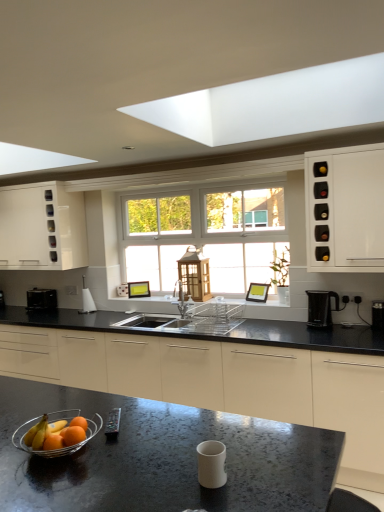
Question: Can you confirm if black plastic coffee machine at right is positioned to the right of clear glass bowl at lower left?

Choices:
 (A) yes
 (B) no

Answer: (A)

Question: Can you confirm if black plastic coffee machine at right is thinner than clear glass bowl at lower left?

Choices:
 (A) no
 (B) yes

Answer: (B)

Question: Is black plastic coffee machine at right oriented away from clear glass bowl at lower left?

Choices:
 (A) no
 (B) yes

Answer: (A)

Question: Is black plastic coffee machine at right to the left of clear glass bowl at lower left from the viewer's perspective?

Choices:
 (A) no
 (B) yes

Answer: (A)

Question: Is black plastic coffee machine at right not inside clear glass bowl at lower left?

Choices:
 (A) no
 (B) yes

Answer: (B)

Question: Is black plastic coffee machine at right wider than clear glass bowl at lower left?

Choices:
 (A) no
 (B) yes

Answer: (A)

Question: Is white glossy trash can at left, which is counted as the 2th appliance, starting from the back, directly adjacent to black granite countertop at center?

Choices:
 (A) no
 (B) yes

Answer: (A)

Question: Considering the relative positions of white glossy trash can at left, the second appliance from the left, and black granite countertop at center in the image provided, is white glossy trash can at left, the second appliance from the left, in front of black granite countertop at center?

Choices:
 (A) yes
 (B) no

Answer: (B)

Question: Can you confirm if white glossy trash can at left, the second appliance from the left, is positioned to the left of black granite countertop at center?

Choices:
 (A) yes
 (B) no

Answer: (A)

Question: Considering the relative sizes of white glossy trash can at left, which is counted as the 2th appliance, starting from the back, and black granite countertop at center in the image provided, is white glossy trash can at left, which is counted as the 2th appliance, starting from the back, taller than black granite countertop at center?

Choices:
 (A) yes
 (B) no

Answer: (B)

Question: Is white glossy trash can at left, which is counted as the 2th appliance, starting from the back, further to camera compared to black granite countertop at center?

Choices:
 (A) yes
 (B) no

Answer: (A)

Question: Considering the relative sizes of white glossy trash can at left, the second appliance from the left, and black granite countertop at center in the image provided, is white glossy trash can at left, the second appliance from the left, smaller than black granite countertop at center?

Choices:
 (A) yes
 (B) no

Answer: (A)

Question: Is metallic remote control at center, the 3th appliance positioned from the right, located within black plastic coffee maker at right, which appears as the 3th appliance when viewed from the back?

Choices:
 (A) no
 (B) yes

Answer: (A)